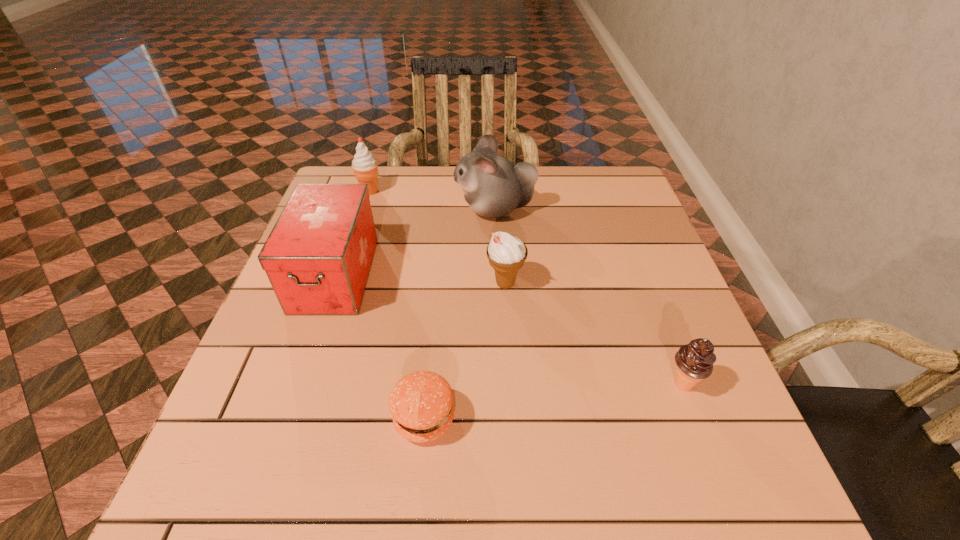
Identify the location of vacant space situated on the front of the leftmost icecream. Image resolution: width=960 pixels, height=540 pixels. (340, 285).

You are a GUI agent. You are given a task and a screenshot of the screen. Output one action in this format:
    pyautogui.click(x=<x>, y=<y>)
    Task: Click on the vacant space positioned 0.270m on the handle side of the first-aid kit
    The width and height of the screenshot is (960, 540).
    Given the screenshot: What is the action you would take?
    pyautogui.click(x=278, y=441)

Find the location of a particular element. This screenshot has width=960, height=540. vacant area situated on the left of the second icecream from right to left is located at coordinates (464, 284).

Locate an element on the screen. Image resolution: width=960 pixels, height=540 pixels. free space located on the back of the fifth tallest object is located at coordinates tap(634, 255).

Identify the location of free region located on the right of the shortest object. (489, 418).

The height and width of the screenshot is (540, 960). I want to click on hamster at the far edge, so click(493, 186).

Identify the location of icecream located in the far edge section of the desktop. This screenshot has height=540, width=960. (364, 165).

The width and height of the screenshot is (960, 540). What are the coordinates of `icecream that is at the left edge` in the screenshot? It's located at (364, 165).

Locate an element on the screen. the first-aid kit present at the left edge is located at coordinates (318, 256).

Identify the location of object at the right edge. The width and height of the screenshot is (960, 540). (695, 360).